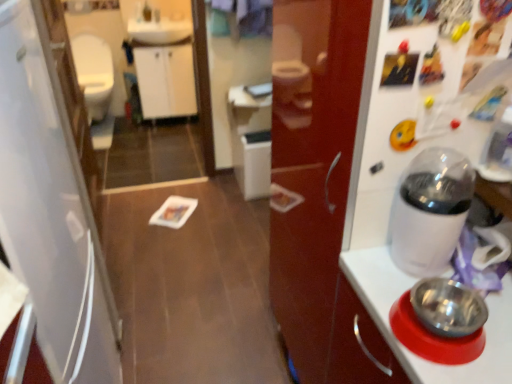
The height and width of the screenshot is (384, 512). Identify the location of free location in front of matte white faucet at upper center. (154, 32).